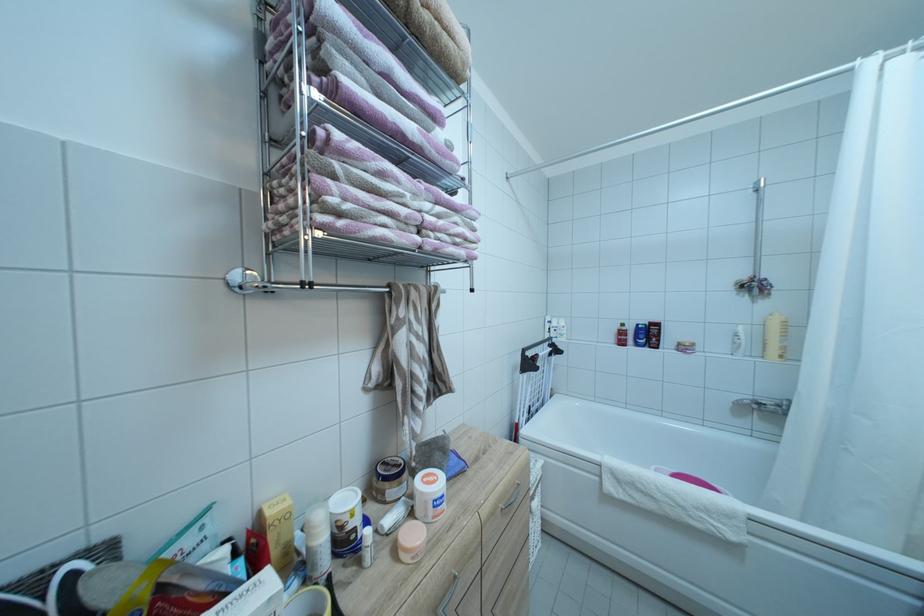
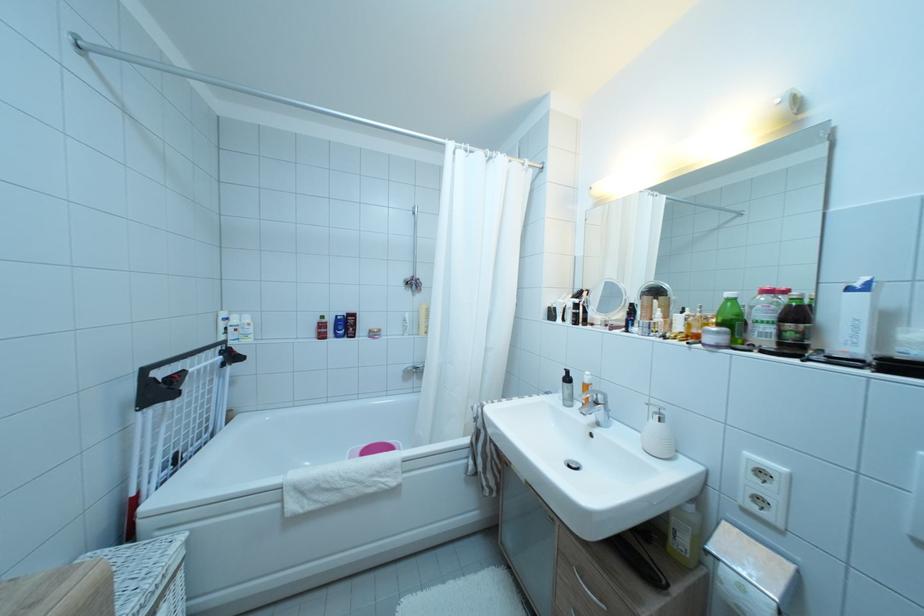
Locate, in the second image, the point that corresponds to (775,197) in the first image.

(428, 222)